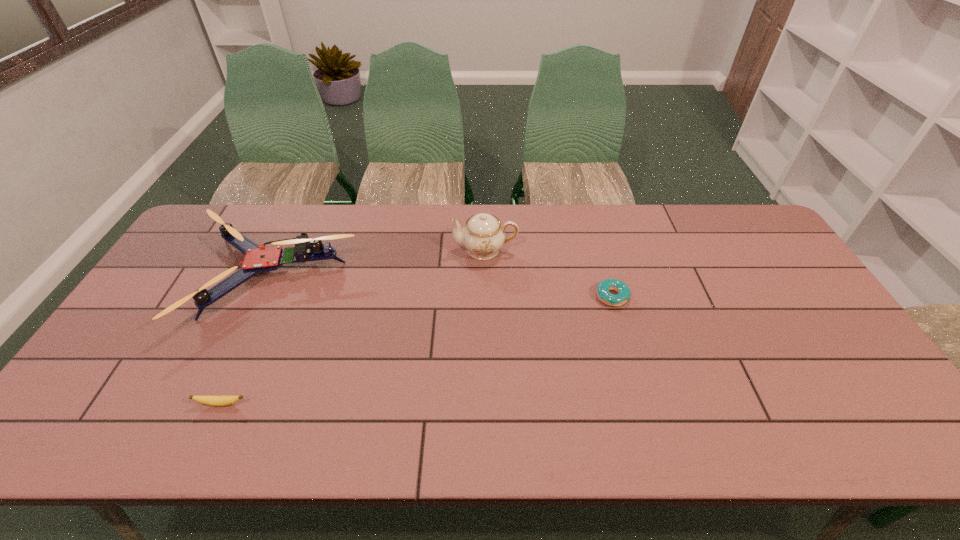
The height and width of the screenshot is (540, 960). I want to click on object that is the second closest one to the nearest object, so click(x=483, y=236).

Identify which object is the third nearest to the nearest object. Please provide its 2D coordinates. Your answer should be formatted as a tuple, i.e. [(x, y)], where the tuple contains the x and y coordinates of a point satisfying the conditions above.

[(603, 293)]

This screenshot has width=960, height=540. Identify the location of free point that satisfies the following two spatial constraints: 1. at the spout of the tallest object; 2. on the front side of the nearest object. (487, 404).

Where is `vacant space that satisfies the following two spatial constraints: 1. on the back side of the banana; 2. on the right side of the doughnut`? vacant space that satisfies the following two spatial constraints: 1. on the back side of the banana; 2. on the right side of the doughnut is located at coordinates (270, 296).

This screenshot has width=960, height=540. I want to click on free spot that satisfies the following two spatial constraints: 1. at the spout of the chinaware; 2. on the right side of the rightmost object, so click(486, 296).

At what (x,y) coordinates should I click in order to perform the action: click on free space that satisfies the following two spatial constraints: 1. on the back side of the doughnut; 2. at the spout of the chinaware. Please return your answer as a coordinate pair (x, y). This screenshot has width=960, height=540. Looking at the image, I should click on (599, 250).